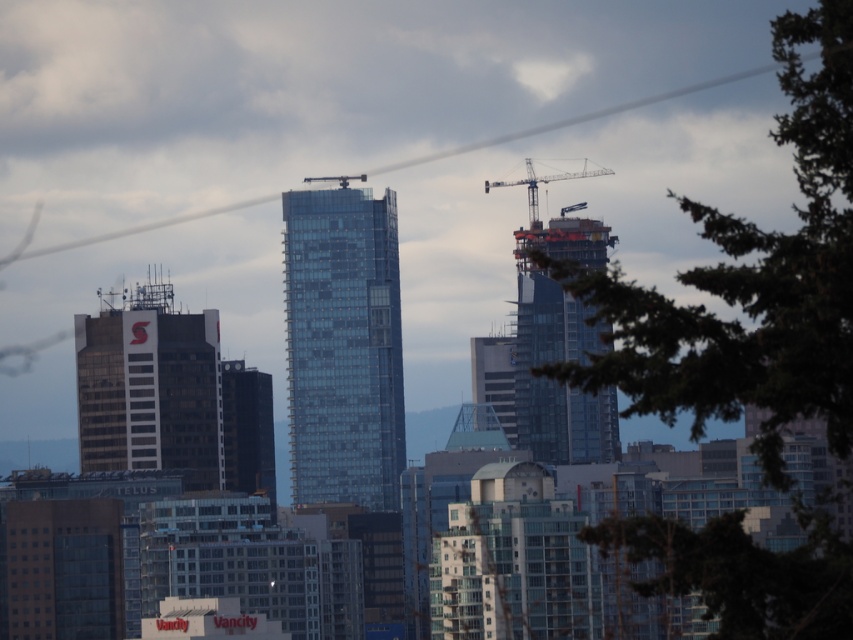
You are a drone operator tasked with capturing aerial footage of the cityscape. Your drone is currently positioned at the camera location. The green leafy tree at upper right is part of your shot. To ensure safety, you must maintain a minimum distance of 2000 feet from any obstacles. Is your current position compliant with safety regulations?

The green leafy tree at upper right is 2137.87 feet away from camera, which exceeds the minimum required distance of 2000 feet. Therefore, the current position is compliant with safety regulations.

You are an architect analyzing the cityscape. You notice the transparent glass building at center and the glassy steel skyscraper at center. Which of these two buildings has a greater width?

The transparent glass building at center has a greater width than the glassy steel skyscraper at center according to the description.

What are the coordinates of the green leafy tree at center in the image?

The green leafy tree at center is located at coordinates point (x=743, y=573).